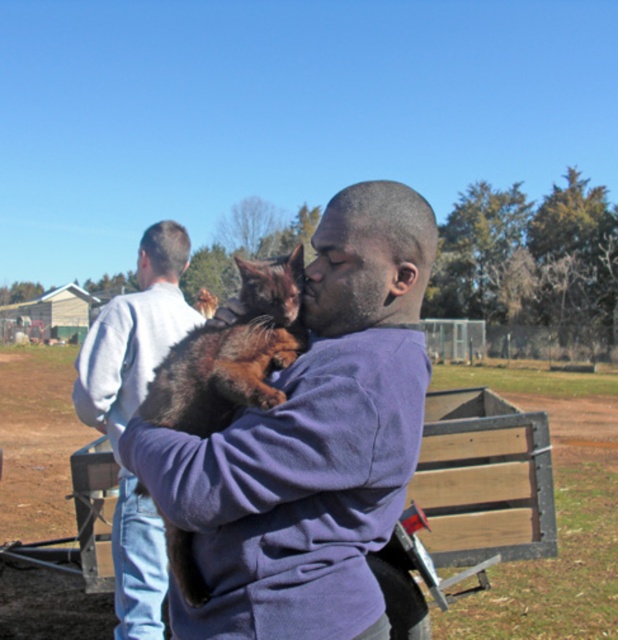
Does point (345, 241) come closer to viewer compared to point (153, 609)?

That is True.

Where is `brown furry cat at center`? The image size is (618, 640). brown furry cat at center is located at coordinates (311, 442).

Locate an element on the screen. brown furry cat at center is located at coordinates (311, 442).